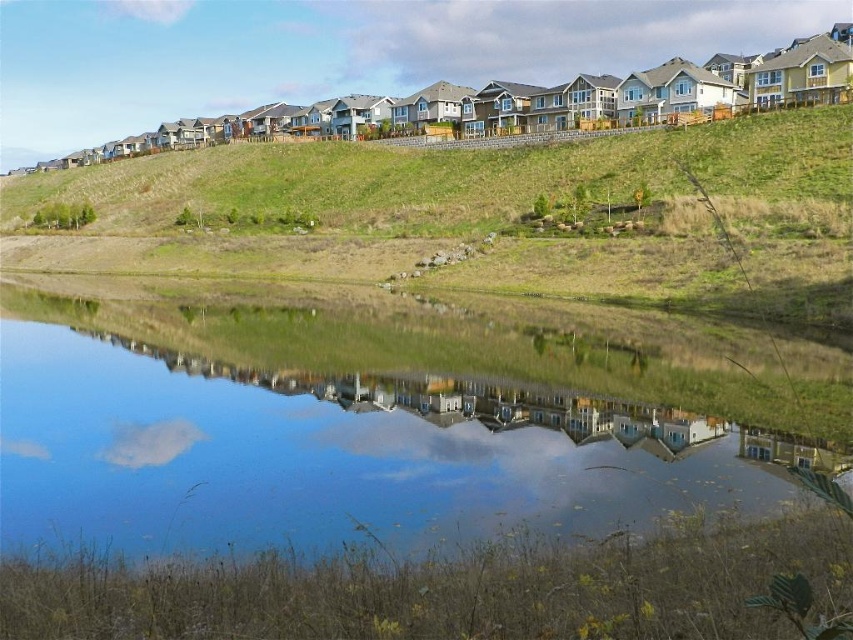
You are standing at the edge of the water and want to place a small floating dock exactly 23 meters away from where you are standing. Can you use the transparent glass water at center to determine the distance?

Result: The transparent glass water at center is 22.99 meters from the viewer, so placing the dock exactly 23 meters away would be just slightly beyond the transparent glass water at center.

You are standing on the green grassy hillside at upper center and want to walk down to the transparent glass water at center. Is the path directly below you leading towards the water?

Yes, the transparent glass water at center is located below the green grassy hillside at upper center, so the path directly below you leads towards the water.